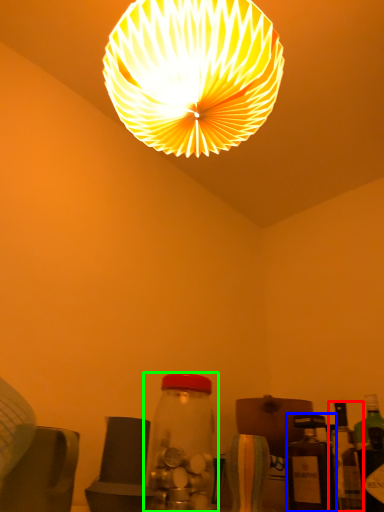
Question: Which object is positioned farthest from bottle (highlighted by a red box)? Select from bottle (highlighted by a blue box) and bottle (highlighted by a green box).

Choices:
 (A) bottle
 (B) bottle

Answer: (B)